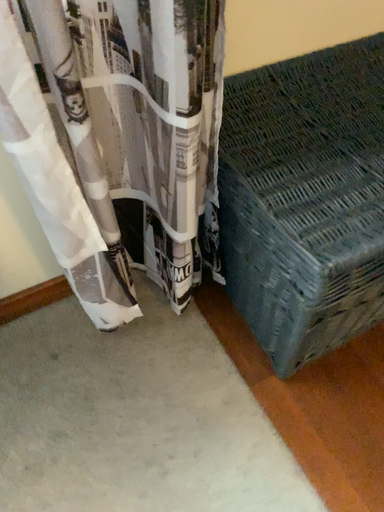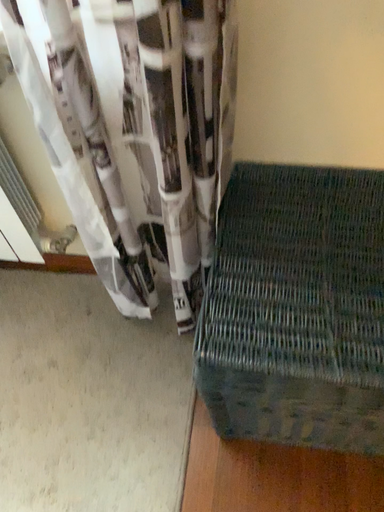
Question: Which way did the camera rotate in the video?

Choices:
 (A) rotated downward
 (B) rotated upward

Answer: (B)